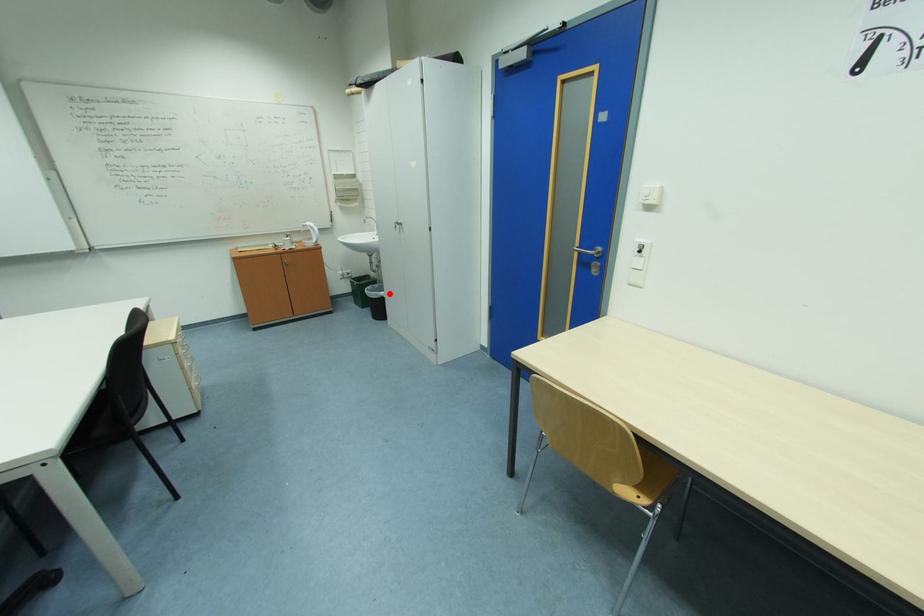
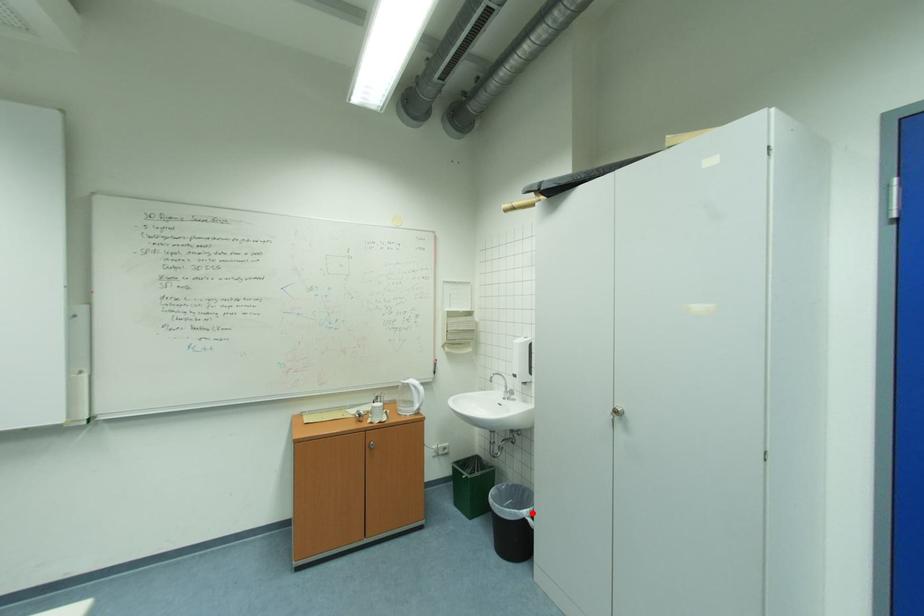
I am providing you with two images of the same scene from different viewpoints. A red point is marked on the first image and another point is marked on the second image. Does the point marked in image1 correspond to the same location as the one in image2?

Yes